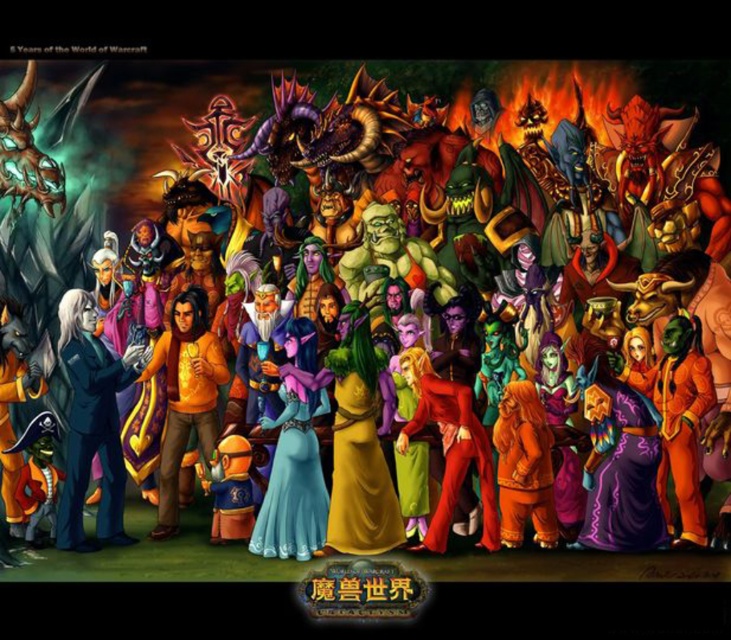
Question: Which of the following is the closest to the observer?

Choices:
 (A) shiny red suit at center
 (B) smooth blue suit at left

Answer: (A)

Question: Which point appears farthest from the camera in this image?

Choices:
 (A) (446, 477)
 (B) (80, 465)

Answer: (B)

Question: Which object is positioned farthest from the orange cotton sweater at center?

Choices:
 (A) smooth blue suit at left
 (B) shiny red suit at center

Answer: (B)

Question: Is the position of smooth blue suit at left less distant than that of orange cotton sweater at center?

Choices:
 (A) no
 (B) yes

Answer: (B)

Question: Is smooth blue suit at left below shiny red suit at center?

Choices:
 (A) no
 (B) yes

Answer: (A)

Question: Does smooth blue suit at left have a larger size compared to orange cotton sweater at center?

Choices:
 (A) yes
 (B) no

Answer: (A)